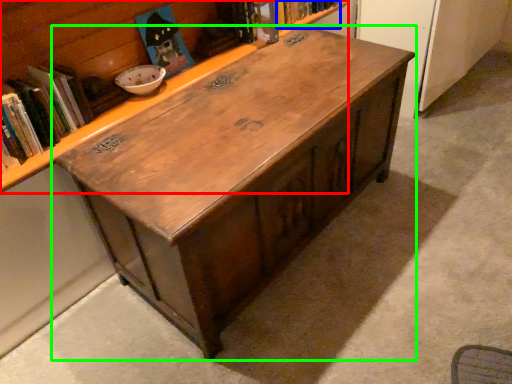
Question: Estimate the real-world distances between objects in this image. Which object is closer to bookcase (highlighted by a red box), book (highlighted by a blue box) or table (highlighted by a green box)?

Choices:
 (A) book
 (B) table

Answer: (A)